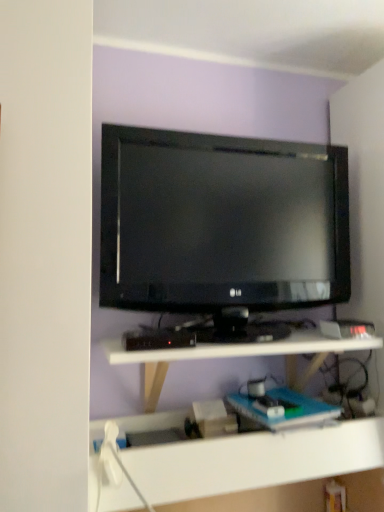
In order to click on white plastic shelf at lower center in this screenshot , I will do coord(238,356).

Describe the element at coordinates (238, 356) in the screenshot. I see `white plastic shelf at lower center` at that location.

Measure the distance between point (211, 249) and camera.

Point (211, 249) is 4.24 feet away from camera.

You are a GUI agent. You are given a task and a screenshot of the screen. Output one action in this format:
    pyautogui.click(x=<x>, y=<y>)
    Task: Click on the black glossy tv at center
    Image resolution: width=384 pixels, height=512 pixels.
    Given the screenshot: What is the action you would take?
    pyautogui.click(x=221, y=222)

Measure the distance between black glossy tv at center and camera.

black glossy tv at center and camera are 1.19 meters apart from each other.

Describe the element at coordinates (221, 222) in the screenshot. I see `black glossy tv at center` at that location.

The width and height of the screenshot is (384, 512). In order to click on white plastic shelf at lower center in this screenshot , I will do `click(238, 356)`.

Is black glossy tv at center to the left of white plastic shelf at lower center from the viewer's perspective?

No.

Who is more distant, black glossy tv at center or white plastic shelf at lower center?

black glossy tv at center is behind.

Is point (135, 298) positioned after point (158, 396)?

No, (135, 298) is closer to viewer.

From the image's perspective, is black glossy tv at center below white plastic shelf at lower center?

Actually, black glossy tv at center appears above white plastic shelf at lower center in the image.

From a real-world perspective, relative to white plastic shelf at lower center, is black glossy tv at center vertically above or below?

black glossy tv at center is situated higher than white plastic shelf at lower center in the real world.

Considering the relative sizes of black glossy tv at center and white plastic shelf at lower center in the image provided, is black glossy tv at center thinner than white plastic shelf at lower center?

Correct, the width of black glossy tv at center is less than that of white plastic shelf at lower center.

Is black glossy tv at center taller than white plastic shelf at lower center?

Indeed, black glossy tv at center has a greater height compared to white plastic shelf at lower center.

Does black glossy tv at center have a larger size compared to white plastic shelf at lower center?

No.

Would you say white plastic shelf at lower center is part of black glossy tv at center's contents?

No, white plastic shelf at lower center is not a part of black glossy tv at center.

Is black glossy tv at center next to white plastic shelf at lower center?

They are not placed beside each other.

Is black glossy tv at center aimed at white plastic shelf at lower center?

No, black glossy tv at center is not turned towards white plastic shelf at lower center.

How distant is black glossy tv at center from white plastic shelf at lower center?

black glossy tv at center is 12.91 inches away from white plastic shelf at lower center.

This screenshot has height=512, width=384. Identify the location of shelf on the left of black glossy tv at center. point(238,356).

Visually, is white plastic shelf at lower center positioned to the left or to the right of black glossy tv at center?

Based on their positions, white plastic shelf at lower center is located to the left of black glossy tv at center.

Does white plastic shelf at lower center lie behind black glossy tv at center?

No, it is not.

Is point (125, 356) closer or farther from the camera than point (219, 145)?

Point (125, 356) appears to be closer to the viewer than point (219, 145).

From the image's perspective, is white plastic shelf at lower center located above or below black glossy tv at center?

Based on their image positions, white plastic shelf at lower center is located beneath black glossy tv at center.

Based on the photo, from a real-world perspective, which object stands above the other?

black glossy tv at center, from a real-world perspective.

In terms of width, does white plastic shelf at lower center look wider or thinner when compared to black glossy tv at center?

In the image, white plastic shelf at lower center appears to be wider than black glossy tv at center.

Can you confirm if white plastic shelf at lower center is shorter than black glossy tv at center?

Yes, white plastic shelf at lower center is shorter than black glossy tv at center.

Considering the sizes of objects white plastic shelf at lower center and black glossy tv at center in the image provided, who is bigger, white plastic shelf at lower center or black glossy tv at center?

white plastic shelf at lower center.

Could black glossy tv at center be considered to be inside white plastic shelf at lower center?

No, black glossy tv at center is located outside of white plastic shelf at lower center.

Is there a large distance between white plastic shelf at lower center and black glossy tv at center?

No, white plastic shelf at lower center is in close proximity to black glossy tv at center.

Is black glossy tv at center at the back of white plastic shelf at lower center?

No.

How many degrees apart are the facing directions of white plastic shelf at lower center and black glossy tv at center?

white plastic shelf at lower center and black glossy tv at center are facing 0.612 degrees away from each other.

Measure the distance from white plastic shelf at lower center to black glossy tv at center.

They are 12.91 inches apart.

You are a GUI agent. You are given a task and a screenshot of the screen. Output one action in this format:
    pyautogui.click(x=<x>, y=<y>)
    Task: Click on the television behind the white plastic shelf at lower center
    
    Given the screenshot: What is the action you would take?
    point(221,222)

The height and width of the screenshot is (512, 384). Find the location of `television behind the white plastic shelf at lower center`. television behind the white plastic shelf at lower center is located at coordinates (221, 222).

Find the location of `shelf in front of the black glossy tv at center`. shelf in front of the black glossy tv at center is located at coordinates (238, 356).